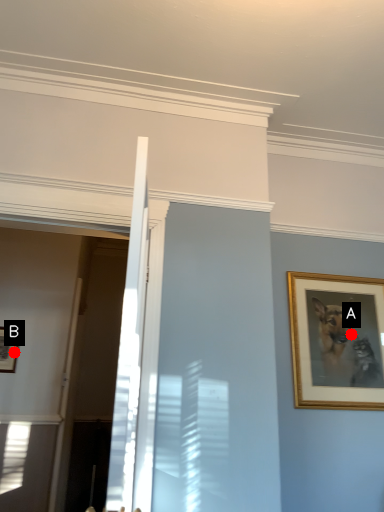
Question: Two points are circled on the image, labeled by A and B beside each circle. Which point is farther from the camera taking this photo?

Choices:
 (A) A is further
 (B) B is further

Answer: (B)